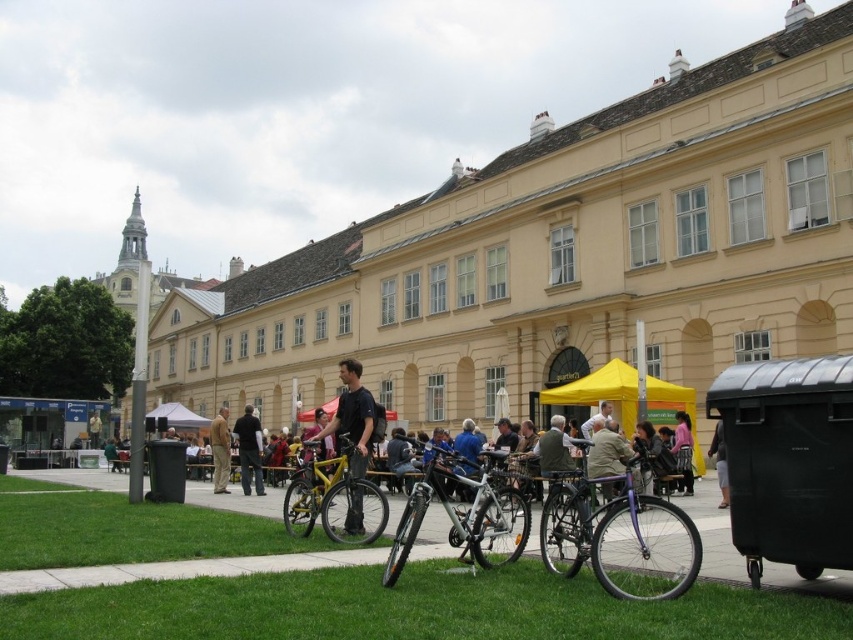
Is point (175, 582) farther from viewer compared to point (345, 477)?

No, (175, 582) is closer to viewer.

Which is in front, point (373, 627) or point (287, 492)?

Point (373, 627) is in front.

Where is `green grass at lower center`? green grass at lower center is located at coordinates (413, 609).

Can you confirm if green grass at lower center is positioned below smooth concrete pavement at center?

No.

Between green grass at lower center and smooth concrete pavement at center, which one is positioned higher?

green grass at lower center is higher up.

Is point (341, 612) closer to camera compared to point (310, 557)?

Yes, it is in front of point (310, 557).

Where is `green grass at lower center`? green grass at lower center is located at coordinates (413, 609).

Does shiny silver bicycle at center come in front of matte black bicycle at center?

Yes, shiny silver bicycle at center is in front of matte black bicycle at center.

Which is behind, point (523, 544) or point (608, 449)?

Point (608, 449)

Between point (425, 497) and point (614, 483), which one is positioned behind?

Point (614, 483)

Find the location of a particular element. The height and width of the screenshot is (640, 853). shiny silver bicycle at center is located at coordinates (463, 513).